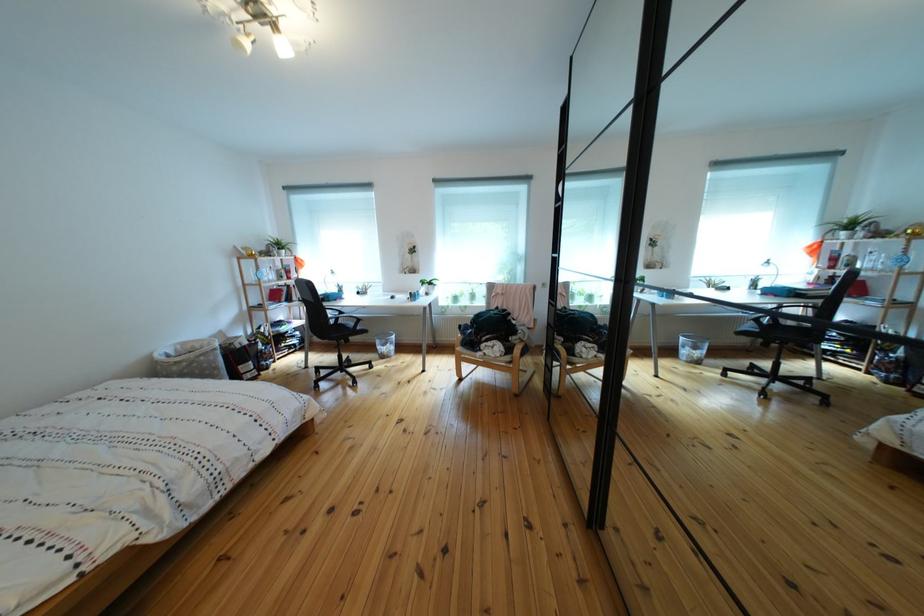
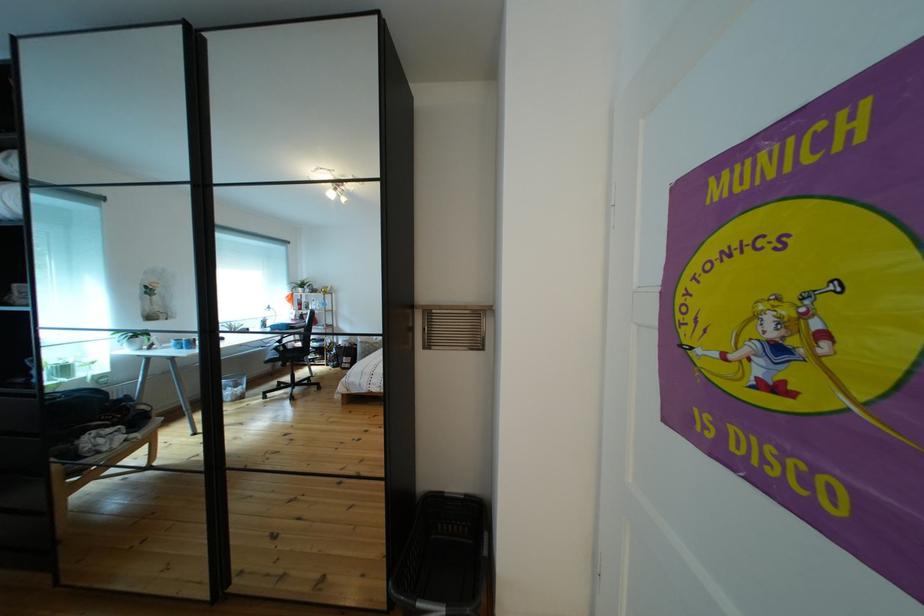
Question: The camera is either moving clockwise (left) or counter-clockwise (right) around the object. The first image is from the beginning of the video and the second image is from the end. Is the camera moving left or right when shooting the video?

Choices:
 (A) Left
 (B) Right

Answer: (A)